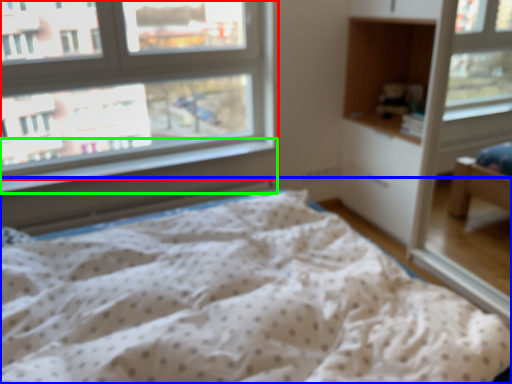
Question: Based on their relative distances, which object is nearer to window (highlighted by a red box)? Choose from bed (highlighted by a blue box) and window sill (highlighted by a green box).

Choices:
 (A) bed
 (B) window sill

Answer: (B)